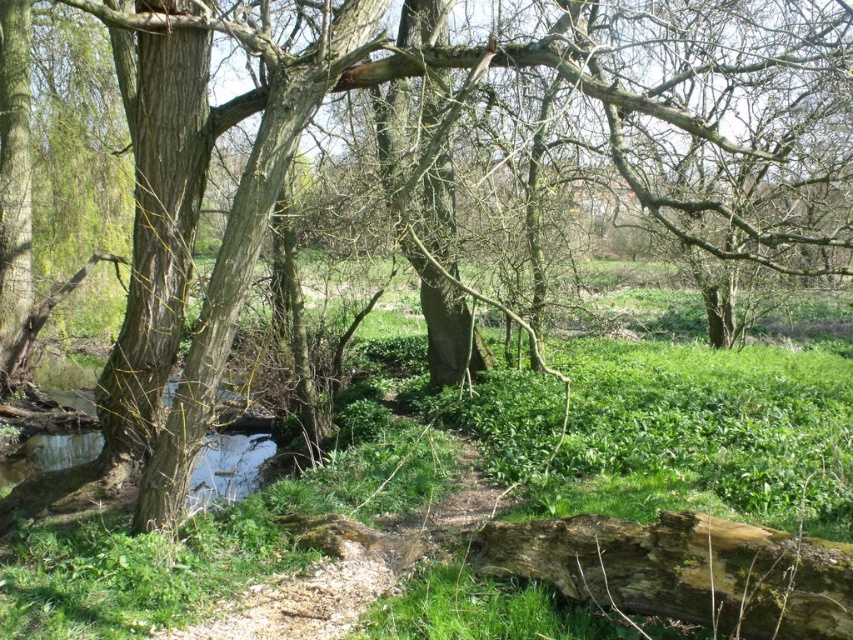
Which is in front, point (47, 577) or point (186, 51)?

Point (47, 577)

Can you confirm if green leafy grass at center is bigger than smooth bark tree trunk at left?

Yes, green leafy grass at center is bigger than smooth bark tree trunk at left.

I want to click on green leafy grass at center, so click(x=701, y=435).